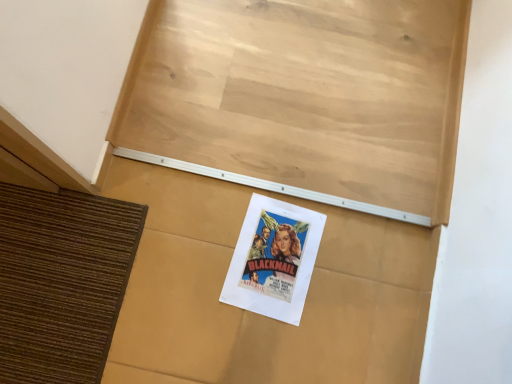
What is the approximate height of matte paper poster at center?

matte paper poster at center is 3.54 centimeters in height.

The width and height of the screenshot is (512, 384). What do you see at coordinates (274, 259) in the screenshot?
I see `matte paper poster at center` at bounding box center [274, 259].

Identify the location of matte paper poster at center. (274, 259).

What do you see at coordinates (304, 98) in the screenshot? This screenshot has width=512, height=384. I see `white paper poster at center` at bounding box center [304, 98].

The height and width of the screenshot is (384, 512). Identify the location of white paper poster at center. (304, 98).

Identify the location of matte paper poster at center. Image resolution: width=512 pixels, height=384 pixels. (274, 259).

Based on the photo, based on their positions, is white paper poster at center located to the left or right of matte paper poster at center?

Clearly, white paper poster at center is on the left of matte paper poster at center in the image.

Is white paper poster at center positioned in front of matte paper poster at center?

Yes, white paper poster at center is closer to the viewer.

Is point (382, 156) closer to camera compared to point (311, 212)?

No, (382, 156) is behind (311, 212).

From the image's perspective, is white paper poster at center positioned above or below matte paper poster at center?

white paper poster at center is above matte paper poster at center.

From the picture: From a real-world perspective, is white paper poster at center physically located above or below matte paper poster at center?

Clearly, from a real-world perspective, white paper poster at center is above matte paper poster at center.

Can you confirm if white paper poster at center is thinner than matte paper poster at center?

Yes, white paper poster at center is thinner than matte paper poster at center.

Who is taller, white paper poster at center or matte paper poster at center?

With more height is white paper poster at center.

Can you confirm if white paper poster at center is bigger than matte paper poster at center?

Yes, white paper poster at center is bigger than matte paper poster at center.

Would you say matte paper poster at center is part of white paper poster at center's contents?

Actually, matte paper poster at center is outside white paper poster at center.

Is white paper poster at center with matte paper poster at center?

No.

Is white paper poster at center oriented towards matte paper poster at center?

No, white paper poster at center does not turn towards matte paper poster at center.

Locate an element on the screen. Image resolution: width=512 pixels, height=384 pixels. bulletin board in front of the matte paper poster at center is located at coordinates (304, 98).

Is matte paper poster at center at the right side of white paper poster at center?

Yes, matte paper poster at center is to the right of white paper poster at center.

Is matte paper poster at center positioned behind white paper poster at center?

Yes, matte paper poster at center is further from the camera.

Which is less distant, (259, 313) or (315, 155)?

Clearly, point (259, 313) is closer to the camera than point (315, 155).

From the image's perspective, does matte paper poster at center appear higher than white paper poster at center?

No, from the image's perspective, matte paper poster at center is not over white paper poster at center.

From a real-world perspective, is matte paper poster at center over white paper poster at center?

No.

Is matte paper poster at center wider than white paper poster at center?

Yes.

Considering the sizes of objects matte paper poster at center and white paper poster at center in the image provided, who is taller, matte paper poster at center or white paper poster at center?

With more height is white paper poster at center.

Considering the relative sizes of matte paper poster at center and white paper poster at center in the image provided, is matte paper poster at center bigger than white paper poster at center?

Incorrect, matte paper poster at center is not larger than white paper poster at center.

Is matte paper poster at center spatially inside white paper poster at center, or outside of it?

matte paper poster at center is spatially situated outside white paper poster at center.

In the scene shown: Are matte paper poster at center and white paper poster at center far apart?

No.

Is matte paper poster at center oriented away from white paper poster at center?

matte paper poster at center does not have its back to white paper poster at center.

In the image, there is a white paper poster at center. Where is `poster below it (from the image's perspective)`? The width and height of the screenshot is (512, 384). poster below it (from the image's perspective) is located at coordinates (274, 259).

Where is `bulletin board that appears above the matte paper poster at center (from the image's perspective)`? bulletin board that appears above the matte paper poster at center (from the image's perspective) is located at coordinates (304, 98).

Where is `poster that appears below the white paper poster at center (from the image's perspective)`? Image resolution: width=512 pixels, height=384 pixels. poster that appears below the white paper poster at center (from the image's perspective) is located at coordinates (274, 259).